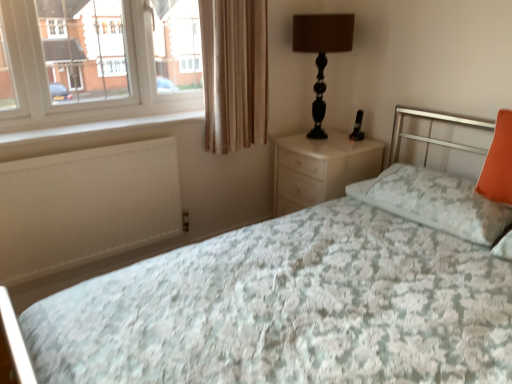
Question: Choose the correct answer: Is white matte radiator at lower left inside floral fabric bed at center or outside it?

Choices:
 (A) inside
 (B) outside

Answer: (B)

Question: Is white matte radiator at lower left taller or shorter than floral fabric bed at center?

Choices:
 (A) tall
 (B) short

Answer: (B)

Question: Which is nearer to the orange fabric pillow at right, which is counted as the second pillow, starting from the left?

Choices:
 (A) floral fabric bed at center
 (B) black glossy table lamp at upper right
 (C) beige fabric curtain at upper left
 (D) white matte radiator at lower left
 (E) orange fabric pillow at right, which is the 1th pillow in left-to-right order

Answer: (E)

Question: Considering the real-world distances, which object is closest to the black glossy table lamp at upper right?

Choices:
 (A) beige fabric curtain at upper left
 (B) floral fabric bed at center
 (C) orange fabric pillow at right, the 2th pillow when ordered from right to left
 (D) orange fabric pillow at right, which ranks as the 1th pillow in right-to-left order
 (E) white matte radiator at lower left

Answer: (A)